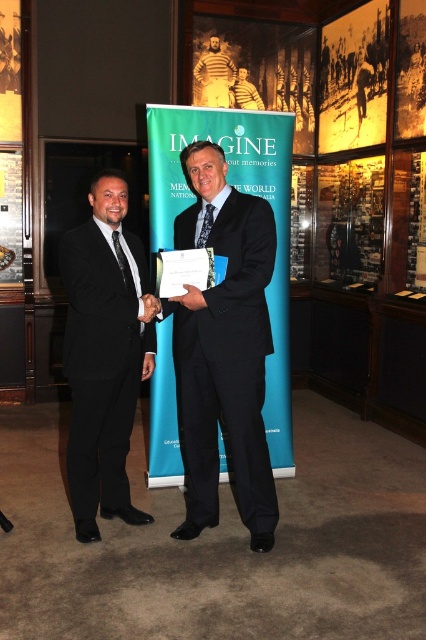
Question: Which object is the closest to the white paper at center?

Choices:
 (A) black suit at center
 (B) striped knit sweater at center

Answer: (A)

Question: Is striped knit sweater at center thinner than yellow shirt at center?

Choices:
 (A) yes
 (B) no

Answer: (B)

Question: Among these objects, which one is farthest from the camera?

Choices:
 (A) black suit at left
 (B) white paper at center

Answer: (A)

Question: Which object appears farthest from the camera in this image?

Choices:
 (A) black suit at left
 (B) black suit at center
 (C) striped knit sweater at center

Answer: (C)

Question: Does black suit at left have a smaller size compared to white paper at center?

Choices:
 (A) no
 (B) yes

Answer: (A)

Question: Does striped knit sweater at center appear over yellow shirt at center?

Choices:
 (A) no
 (B) yes

Answer: (B)